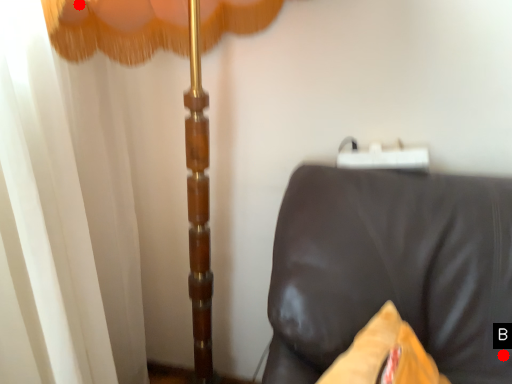
Question: Two points are circled on the image, labeled by A and B beside each circle. Which point is closer to the camera taking this photo?

Choices:
 (A) A is closer
 (B) B is closer

Answer: (A)